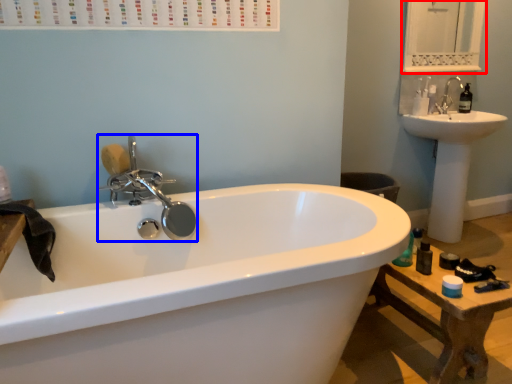
Question: Among these objects, which one is nearest to the camera, medicine cabinet (highlighted by a red box) or tap (highlighted by a blue box)?

Choices:
 (A) medicine cabinet
 (B) tap

Answer: (B)